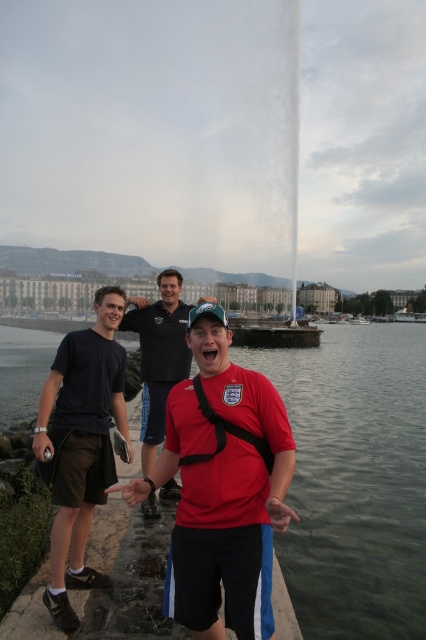
Question: Where is clear water at lower center located in relation to dark gray cotton t-shirt at center in the image?

Choices:
 (A) right
 (B) left

Answer: (A)

Question: Is matte red shirt at center below matte black shirt at center?

Choices:
 (A) no
 (B) yes

Answer: (B)

Question: Which point is farther from the camera taking this photo?

Choices:
 (A) (316, 364)
 (B) (140, 307)
 (C) (224, 404)

Answer: (A)

Question: Can you confirm if matte red shirt at center is positioned to the left of matte black shirt at center?

Choices:
 (A) no
 (B) yes

Answer: (A)

Question: Which of these objects is positioned closest to the clear water at lower center?

Choices:
 (A) dark gray cotton t-shirt at center
 (B) matte black shirt at center
 (C) matte red shirt at center

Answer: (C)

Question: Among these points, which one is farthest from the camera?

Choices:
 (A) (0, 339)
 (B) (66, 397)

Answer: (A)